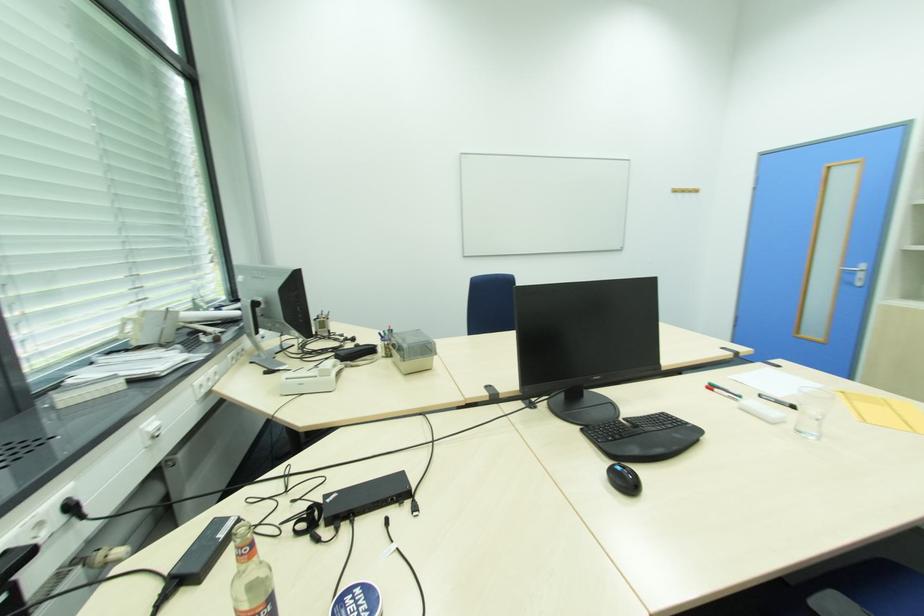
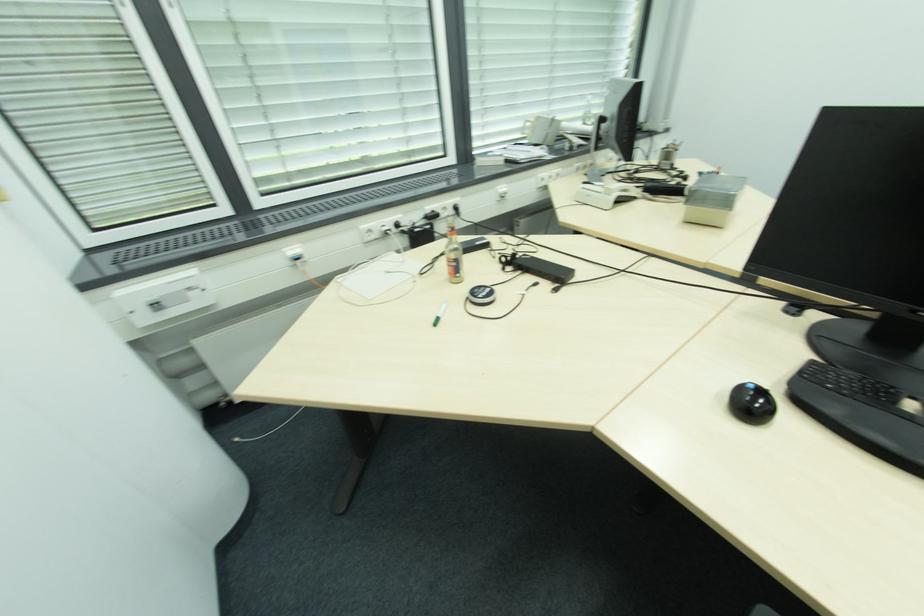
In the second image, find the point that corresponds to pixel 621 468 in the first image.

(755, 387)